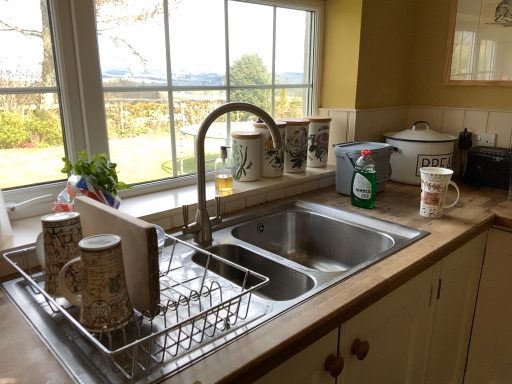
At what (x,y) coordinates should I click in order to perform the action: click on vacant space that is to the left of brown ceramic mug at left, which is the 1th mug in bottom-to-top order. Please return your answer as a coordinate pair (x, y). This screenshot has height=384, width=512. Looking at the image, I should click on (42, 304).